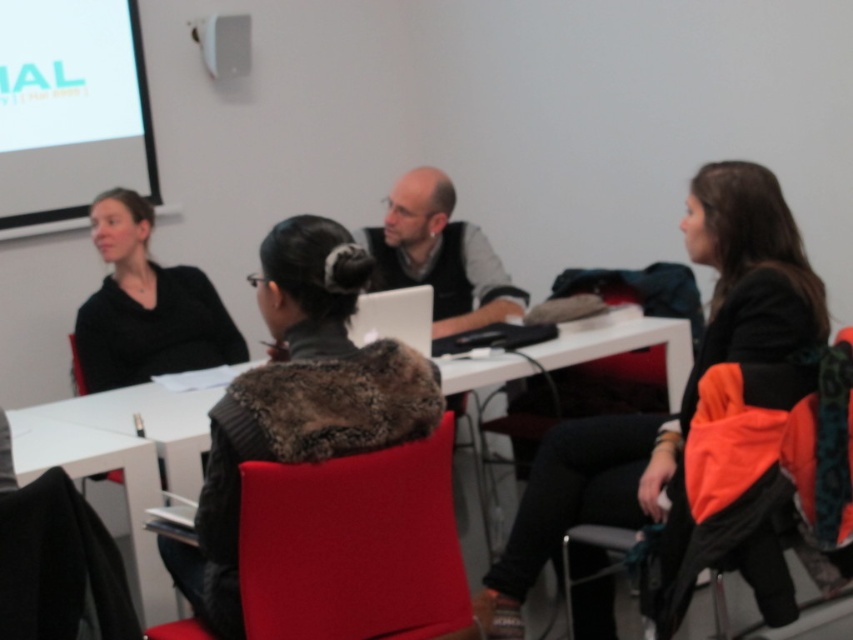
Question: Does velvet red chair at center appear on the right side of white matte projection screen at upper left?

Choices:
 (A) no
 (B) yes

Answer: (B)

Question: Among these objects, which one is nearest to the camera?

Choices:
 (A) velvet red chair at center
 (B) white matte projection screen at upper left
 (C) orange fabric chair at lower right
 (D) black matte jacket at left

Answer: (A)

Question: Can you confirm if black matte jacket at left is smaller than black fabric chair at lower left?

Choices:
 (A) yes
 (B) no

Answer: (B)

Question: Based on their relative distances, which object is nearer to the velvet red chair at center?

Choices:
 (A) dark gray fur coat at center
 (B) black matte jacket at left
 (C) white matte projection screen at upper left

Answer: (A)

Question: Among these points, which one is nearest to the camera?

Choices:
 (A) (740, 529)
 (B) (47, 531)

Answer: (B)

Question: Does black leather jacket at center appear over white plastic table at center?

Choices:
 (A) no
 (B) yes

Answer: (B)